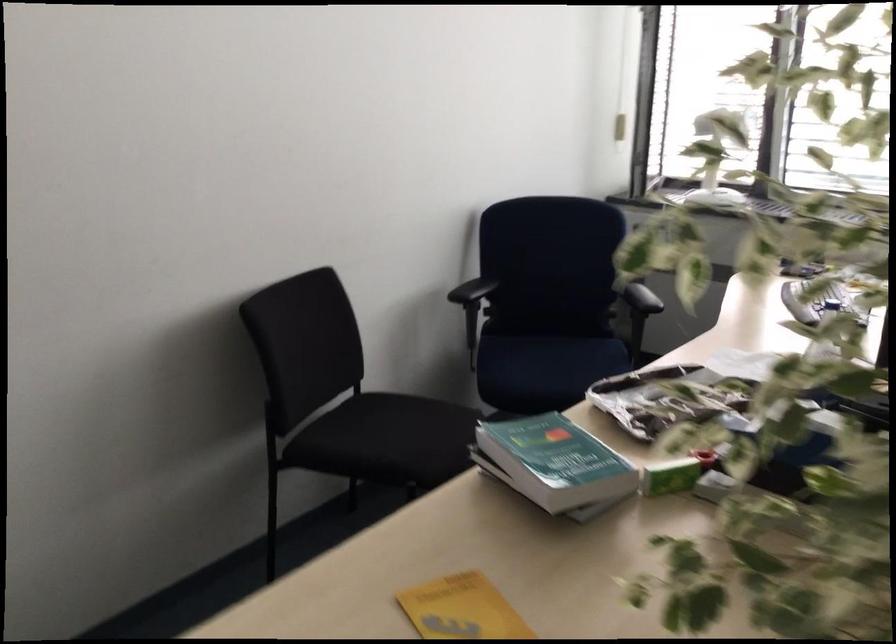
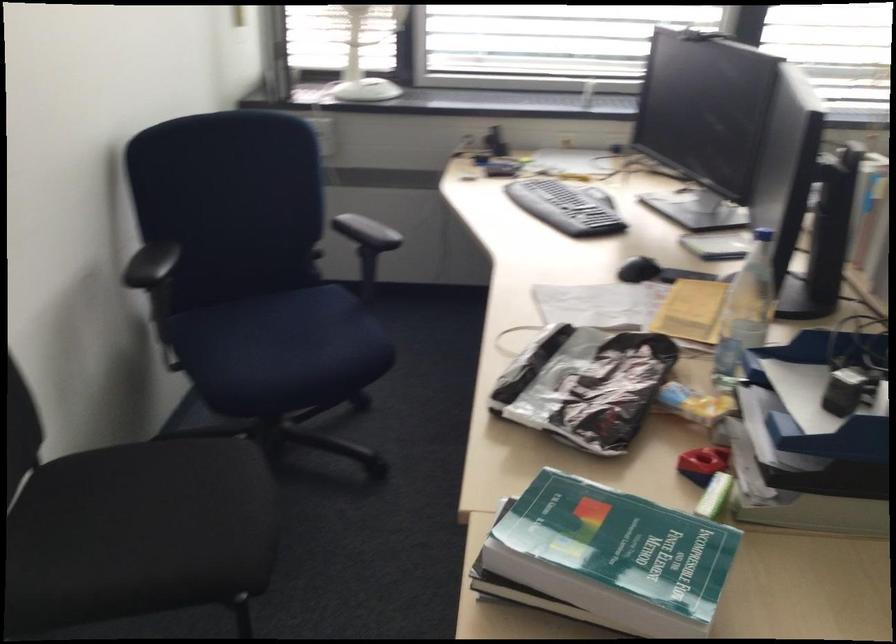
Where in the second image is the point corresponding to the point at 543,361 from the first image?

(278, 346)